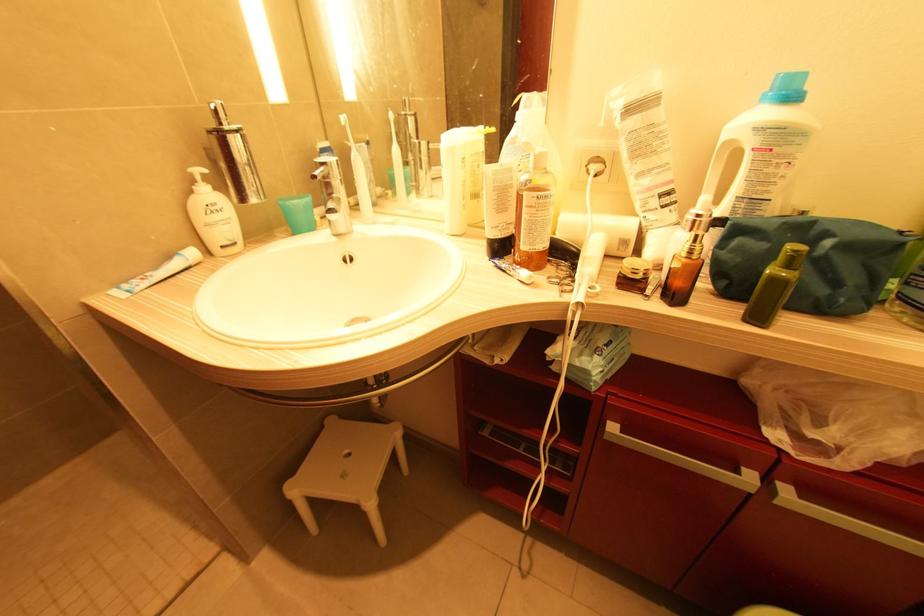
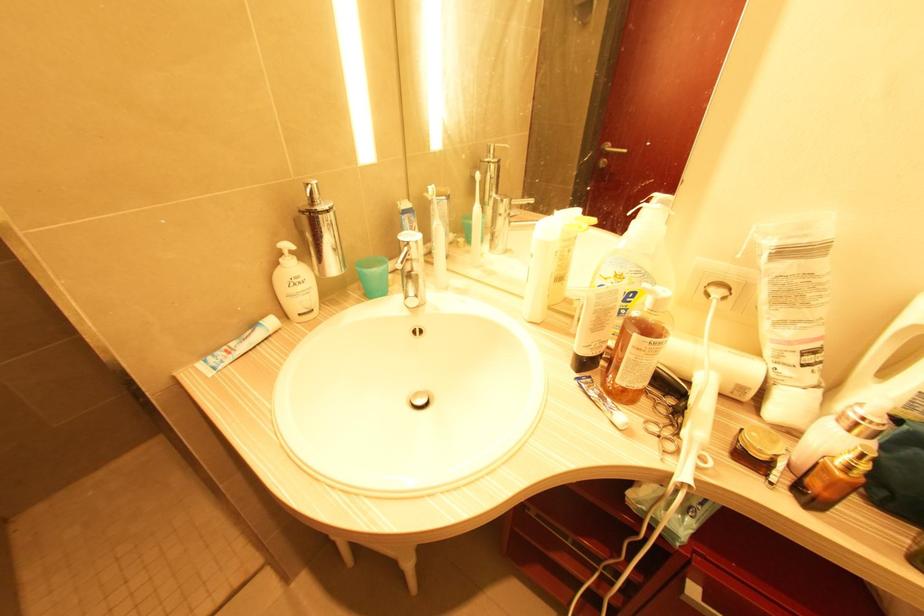
Question: Based on the continuous images, in which direction is the camera rotating? Reply with the corresponding letter.

Choices:
 (A) Left
 (B) Right
 (C) Up
 (D) Down

Answer: (A)